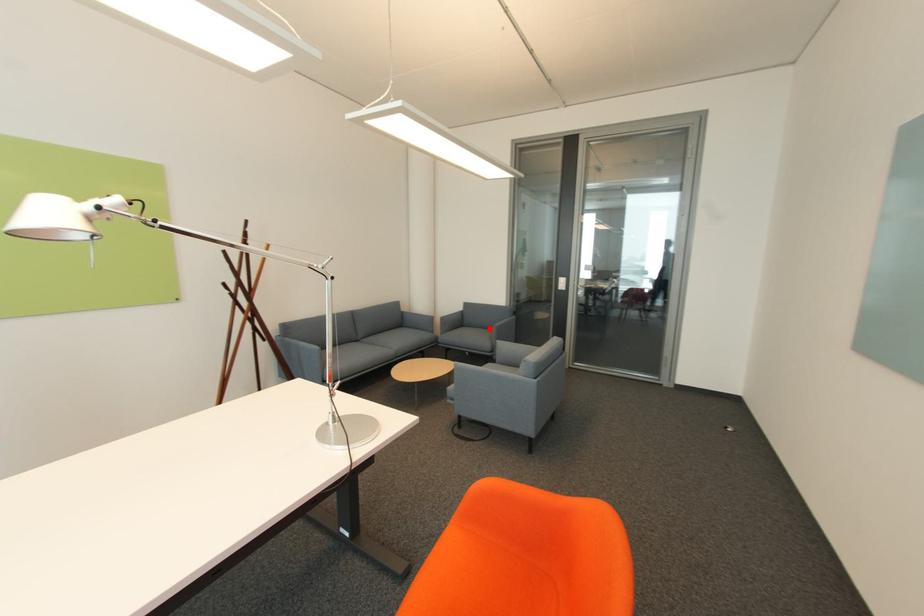
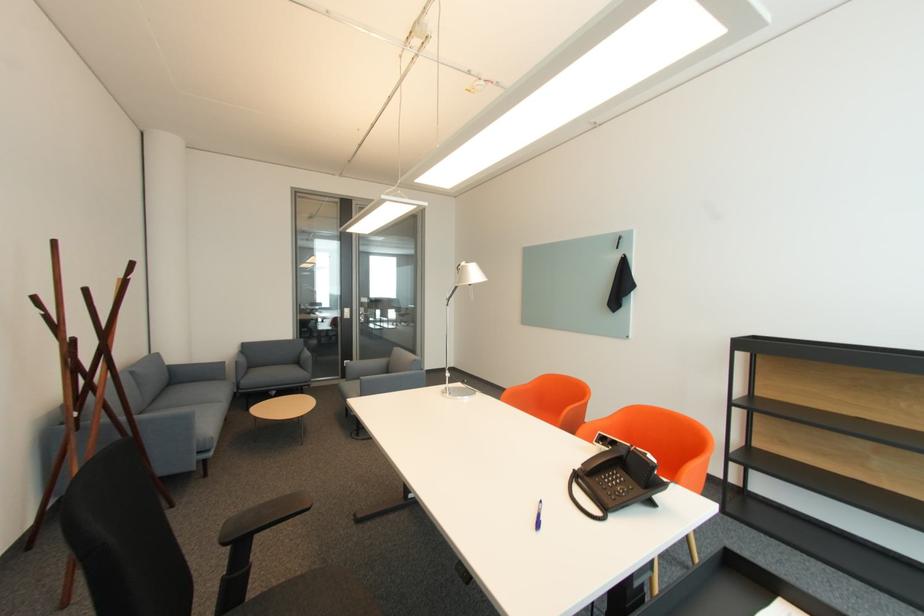
Question: A red point is marked in image1. In image2, is the corresponding 3D point closer to the camera or farther? Reply with the corresponding letter.

Choices:
 (A) The corresponding 3D point is closer.
 (B) The corresponding 3D point is farther.

Answer: (B)